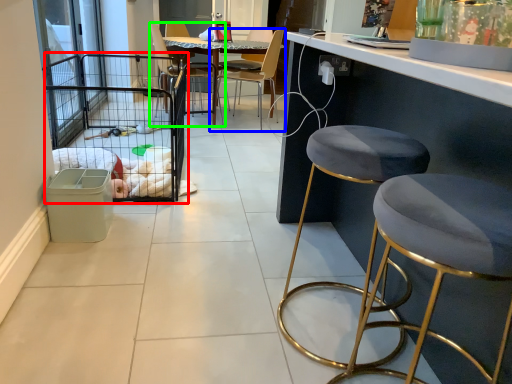
Question: Which is nearer to the cage (highlighted by a red box)? chair (highlighted by a blue box) or chair (highlighted by a green box).

Choices:
 (A) chair
 (B) chair

Answer: (B)